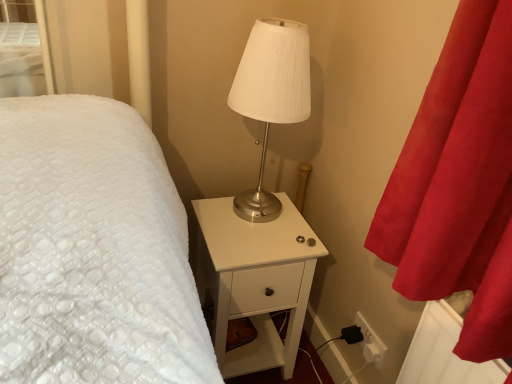
This screenshot has height=384, width=512. In order to click on free location above white glossy nightstand at center (from a real-world perspective) in this screenshot , I will do `click(247, 220)`.